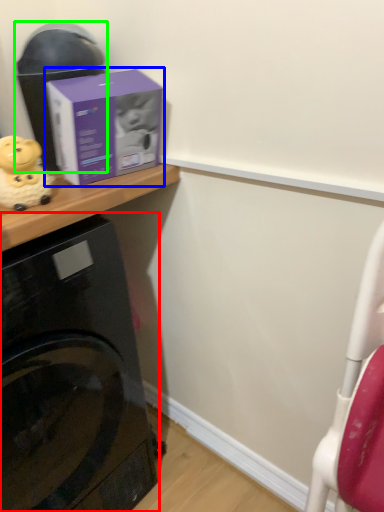
Question: Which object is positioned farthest from home appliance (highlighted by a red box)? Select from box (highlighted by a blue box) and appliance (highlighted by a green box).

Choices:
 (A) box
 (B) appliance

Answer: (B)